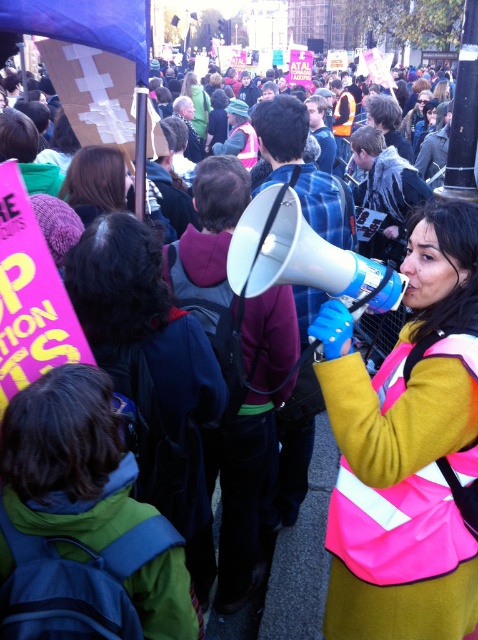
Question: Can you confirm if neon pink reflective vest at center is positioned above blue plastic megaphone at center?

Choices:
 (A) yes
 (B) no

Answer: (B)

Question: Can you confirm if neon pink reflective vest at center is bigger than blue plastic megaphone at center?

Choices:
 (A) yes
 (B) no

Answer: (A)

Question: Which point is closer to the camera?

Choices:
 (A) neon pink reflective vest at center
 (B) blue plastic megaphone at center

Answer: (A)

Question: Is neon pink reflective vest at center below blue plastic megaphone at center?

Choices:
 (A) yes
 (B) no

Answer: (A)

Question: Among these points, which one is farthest from the camera?

Choices:
 (A) (456, 385)
 (B) (279, 246)

Answer: (B)